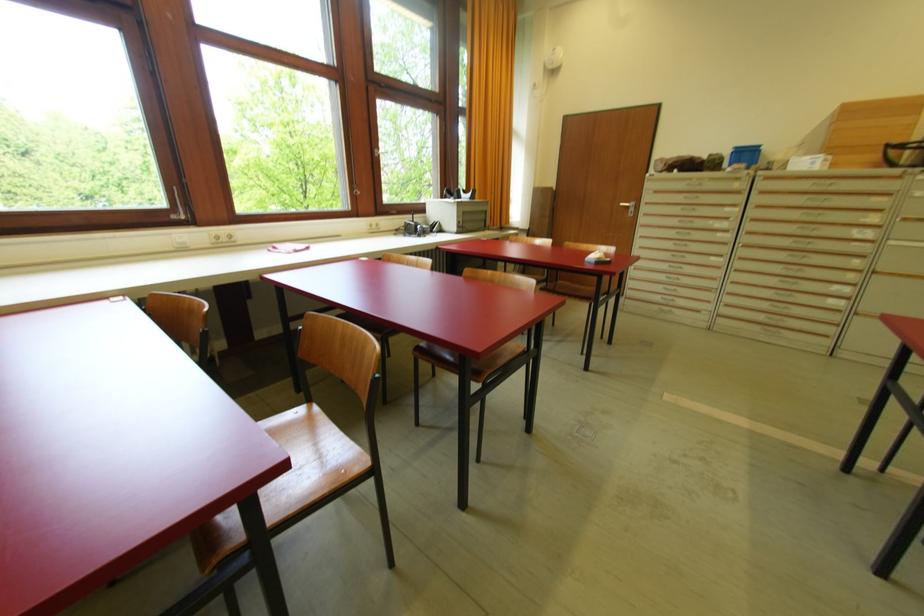
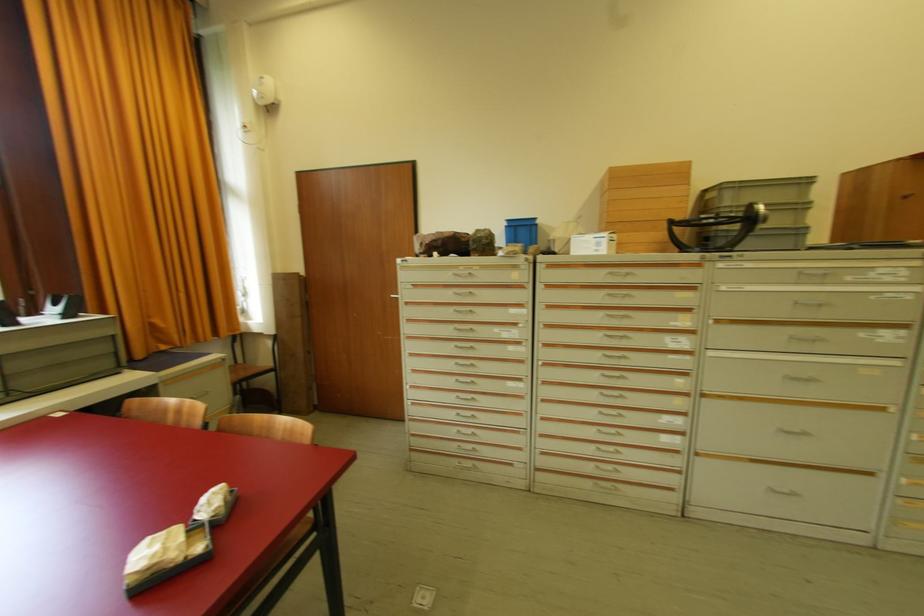
Where in the second image is the point corresponding to (x=736, y=153) from the first image?

(508, 228)